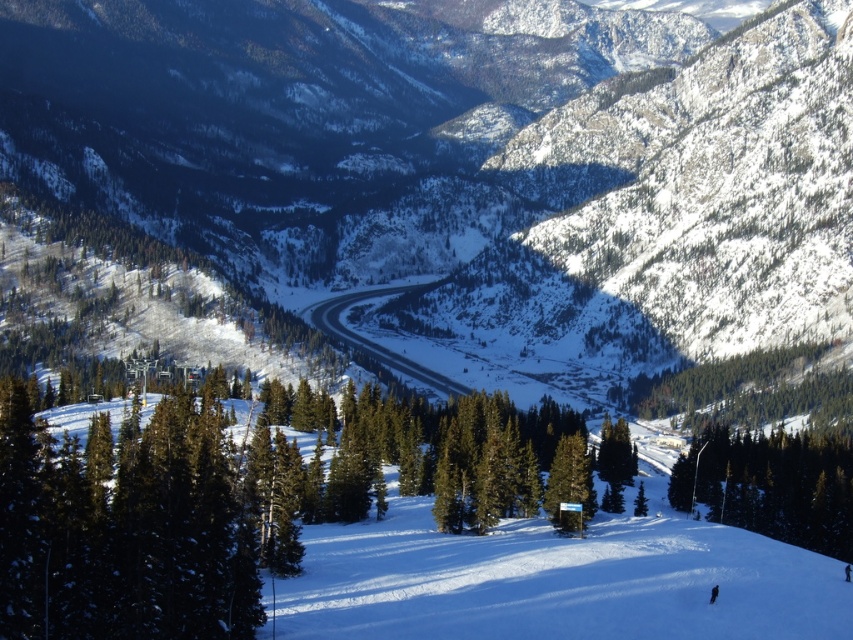
Does green textured tree at lower right appear over green matte sign at center?

Incorrect, green textured tree at lower right is not positioned above green matte sign at center.

Is point (733, 509) positioned before point (555, 512)?

No, (733, 509) is further to viewer.

Image resolution: width=853 pixels, height=640 pixels. Find the location of `green textured tree at lower right`. green textured tree at lower right is located at coordinates (770, 484).

Looking at this image, which of these two, snowy forested mountain at center or green textured tree at lower right, stands shorter?

green textured tree at lower right

Does snowy forested mountain at center lie behind green textured tree at lower right?

Yes, snowy forested mountain at center is behind green textured tree at lower right.

This screenshot has width=853, height=640. I want to click on snowy forested mountain at center, so click(467, 157).

Does snowy forested mountain at center have a smaller size compared to green matte sign at center?

No, snowy forested mountain at center is not smaller than green matte sign at center.

Is point (730, 161) less distant than point (572, 433)?

No, (730, 161) is further to viewer.

What are the coordinates of `snowy forested mountain at center` in the screenshot? It's located at [467, 157].